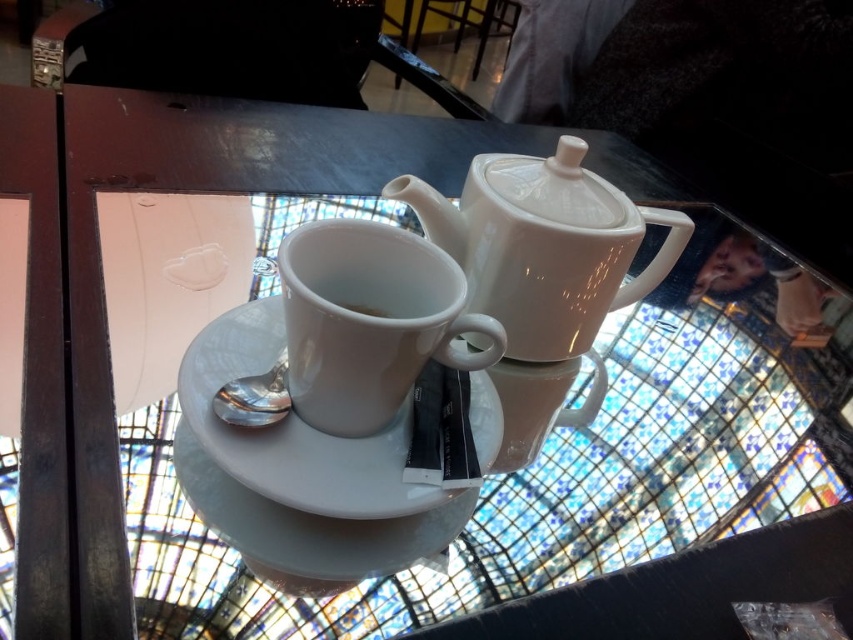
You are setting up a tea station and have both the white glossy mug at center and the white porcelain cup at center. If you want to choose the wider vessel to serve a hot beverage, which one should you pick?

The white glossy mug at center should be chosen because its width is larger than the white porcelain cup at center.

You are setting up a tea service and need to place the white glossy mug at center and the white ceramic saucer at center correctly. According to the image, which object is placed on top of the other?

The white glossy mug at center is positioned over the white ceramic saucer at center, so the mug is placed on top of the saucer.

You are a tea lover who wants to pour hot water from the white glossy teapot at upper center into the white porcelain cup at center. Which object is closer to you, and will you need to reach forward or backward to pour?

The white glossy teapot at upper center is closer to you. To pour the water into the white porcelain cup at center, you will need to reach forward since the cup is farther away.